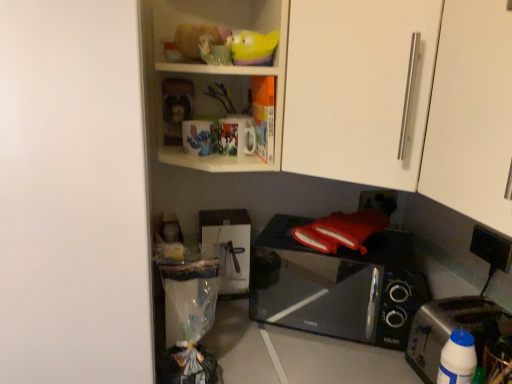
Locate an element on the screen. The image size is (512, 384). free space that is to the left of silver metallic toaster at lower right is located at coordinates (366, 357).